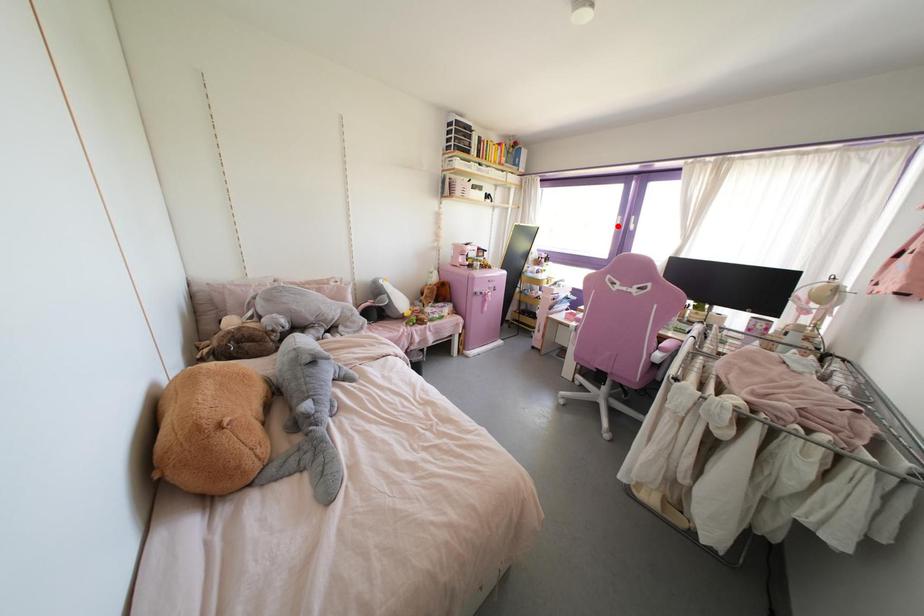
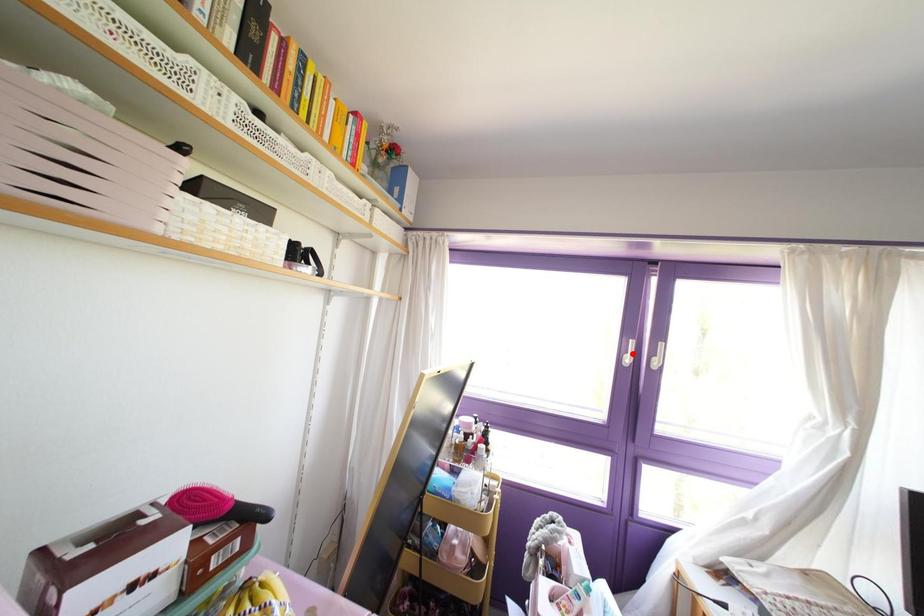
I am providing you with two images of the same scene from different viewpoints. A red point is marked on the first image and another point is marked on the second image. Are the points marked in image1 and image2 representing the same 3D position?

No